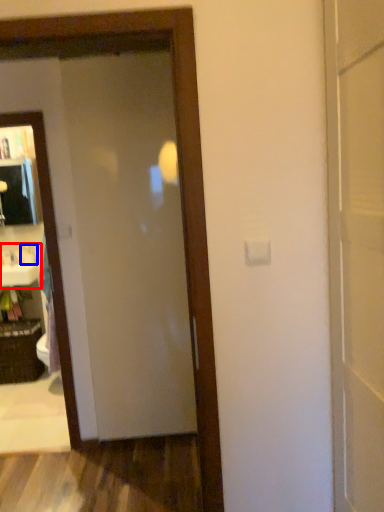
Question: Which of the following is the closest to the observer, sink (highlighted by a red box) or toiletry (highlighted by a blue box)?

Choices:
 (A) sink
 (B) toiletry

Answer: (A)